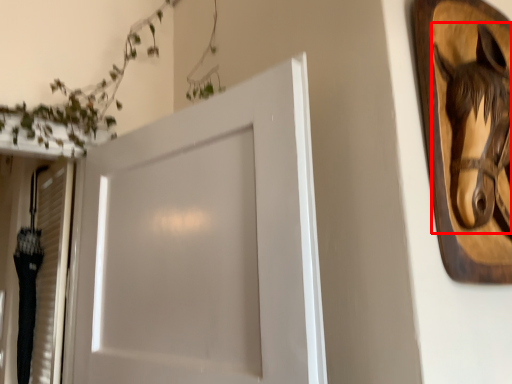
Question: From the image, what is the correct spatial relationship of animal (annotated by the red box) in relation to door?

Choices:
 (A) right
 (B) left

Answer: (A)